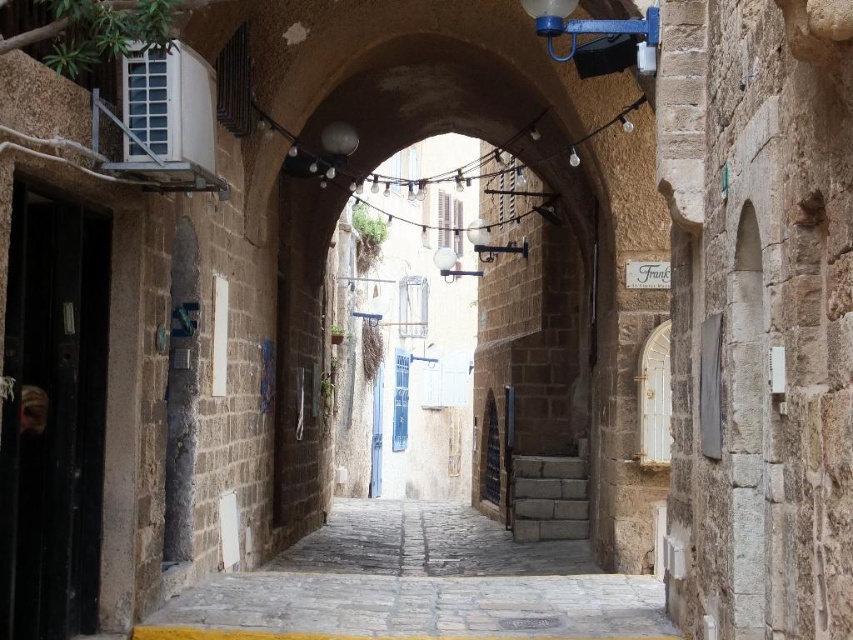
Looking at this image, who is higher up, brown stone archway at center or stone paved alley at center?

brown stone archway at center

Can you confirm if brown stone archway at center is positioned to the right of stone paved alley at center?

In fact, brown stone archway at center is to the left of stone paved alley at center.

Does point (345, 454) come farther from viewer compared to point (556, 602)?

Yes, it is behind point (556, 602).

In order to click on brown stone archway at center in this screenshot , I will do `click(456, 289)`.